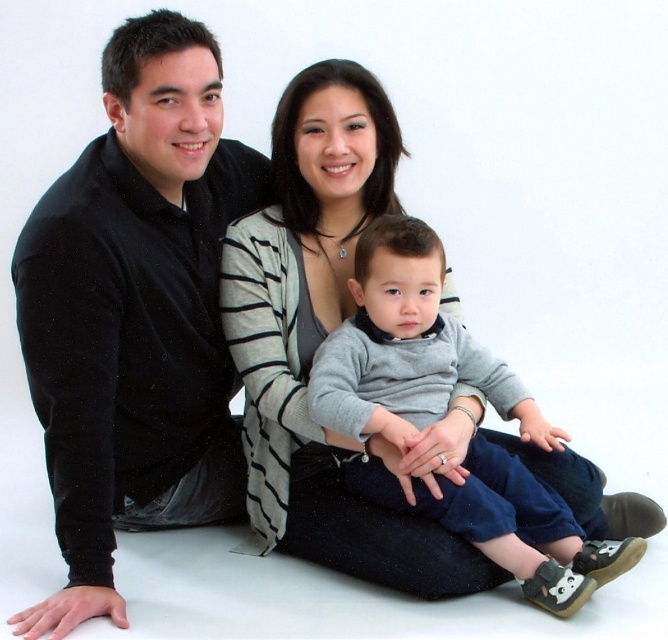
Question: Among these points, which one is farthest from the camera?

Choices:
 (A) (405, 438)
 (B) (218, 403)

Answer: (B)

Question: Is black velvet sweater at left bigger than gray soft sweater at center?

Choices:
 (A) no
 (B) yes

Answer: (B)

Question: Considering the relative positions of black velvet sweater at left and gray soft sweater at center in the image provided, where is black velvet sweater at left located with respect to gray soft sweater at center?

Choices:
 (A) right
 (B) left

Answer: (B)

Question: Which point is closer to the camera taking this photo?

Choices:
 (A) (86, 381)
 (B) (486, 358)

Answer: (A)

Question: Does black velvet sweater at left come behind gray soft sweater at center?

Choices:
 (A) no
 (B) yes

Answer: (A)